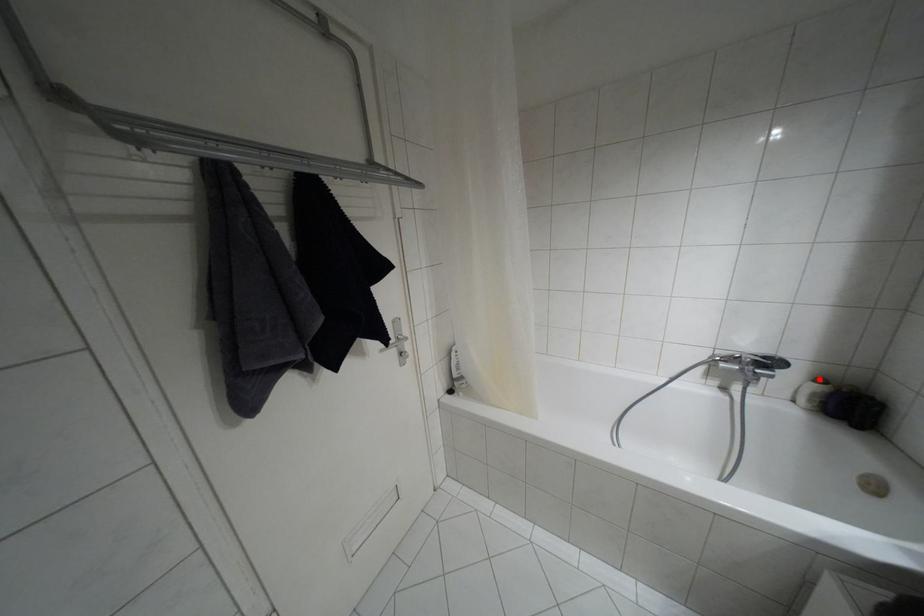
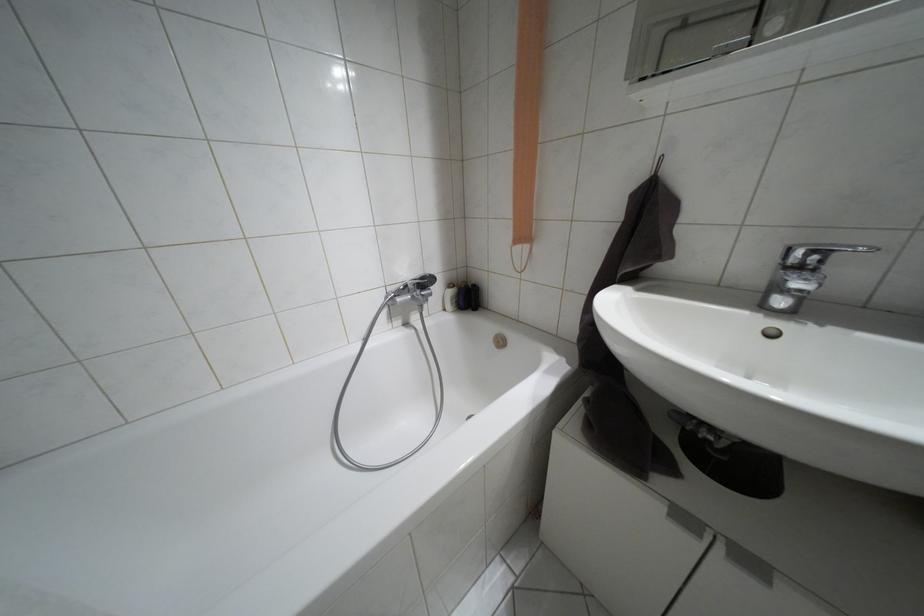
Where in the second image is the point corresponding to the highlighted location from the first image?

(448, 285)